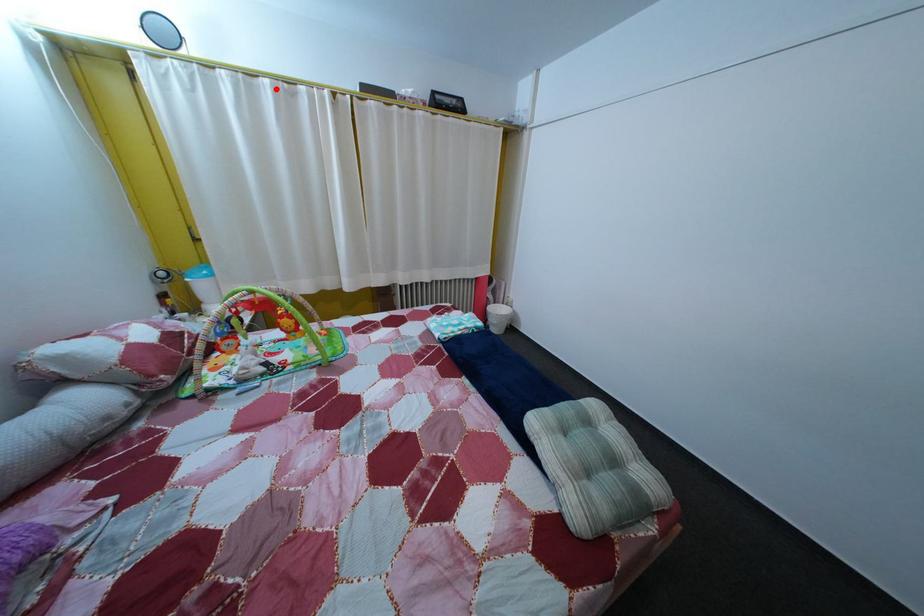
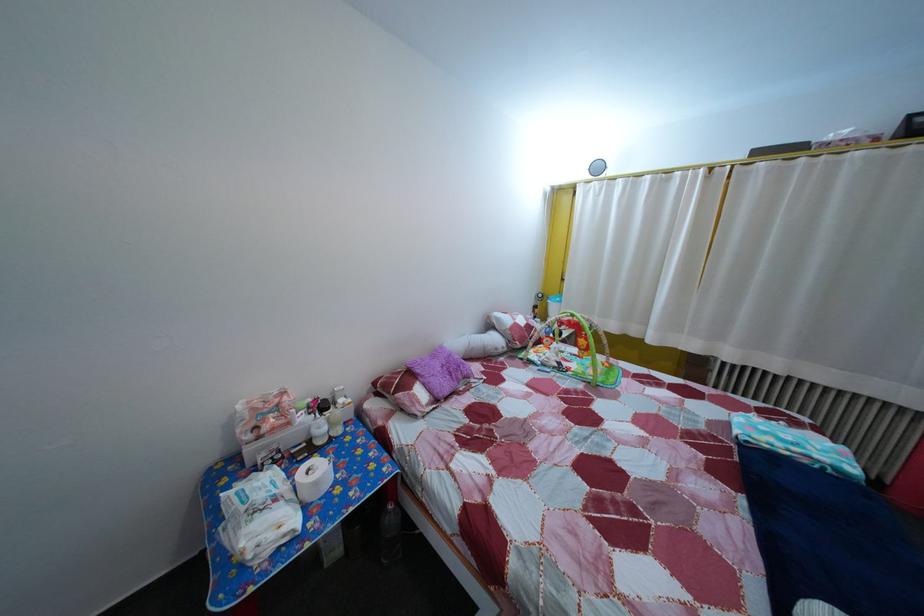
The point at the highlighted location is marked in the first image. Where is the corresponding point in the second image?

(659, 185)